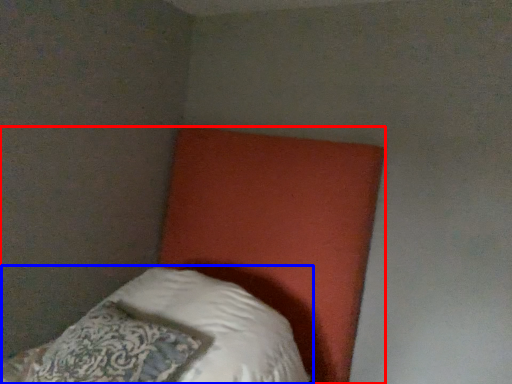
Question: Among these objects, which one is nearest to the camera, bed (highlighted by a red box) or pillow (highlighted by a blue box)?

Choices:
 (A) bed
 (B) pillow

Answer: (A)